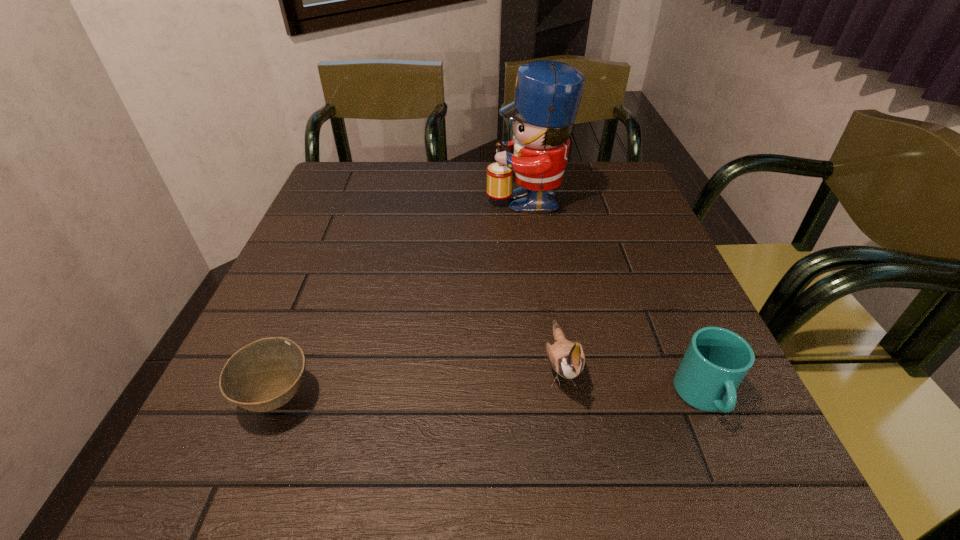
Identify the location of the farthest object. Image resolution: width=960 pixels, height=540 pixels. (548, 93).

This screenshot has width=960, height=540. Identify the location of the tallest object. (548, 93).

This screenshot has height=540, width=960. Find the location of `bird`. bird is located at coordinates (566, 358).

The width and height of the screenshot is (960, 540). What are the coordinates of `the rightmost object` in the screenshot? It's located at (717, 360).

Locate an element on the screen. the second shortest object is located at coordinates (717, 360).

This screenshot has width=960, height=540. What are the coordinates of `bowl` in the screenshot? It's located at (264, 375).

This screenshot has height=540, width=960. I want to click on the leftmost object, so click(264, 375).

Find the location of a particular element. The height and width of the screenshot is (540, 960). vacant space located 0.350m on the front-facing side of the farthest object is located at coordinates (354, 197).

The image size is (960, 540). I want to click on blank area located 0.060m on the front-facing side of the farthest object, so click(464, 197).

The image size is (960, 540). What are the coordinates of `vacant space located 0.120m on the front-facing side of the farthest object` in the screenshot? It's located at (441, 197).